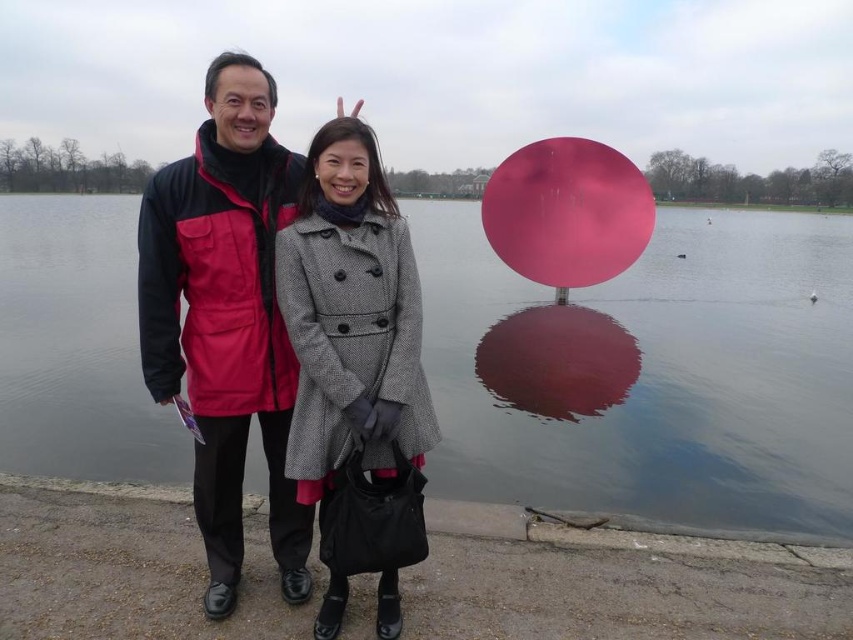
Is pink glossy water at center bigger than matte black jacket at center?

Yes, pink glossy water at center is bigger than matte black jacket at center.

Does pink glossy water at center appear on the right side of matte black jacket at center?

In fact, pink glossy water at center is to the left of matte black jacket at center.

Between point (33, 348) and point (233, 163), which one is positioned behind?

Point (33, 348)

Identify the location of pink glossy water at center. The image size is (853, 640). point(648,372).

Does pink glossy water at center appear over gray wool coat at center?

Yes.

Is pink glossy water at center wider than gray wool coat at center?

Yes.

Does point (724, 225) lie in front of point (335, 536)?

That is False.

Identify the location of pink glossy water at center. This screenshot has height=640, width=853. (648, 372).

Which is more to the left, matte black jacket at center or gray wool coat at center?

Positioned to the left is matte black jacket at center.

Which is in front, point (242, 141) or point (341, 488)?

Point (341, 488)

In order to click on matte black jacket at center in this screenshot , I will do `click(225, 317)`.